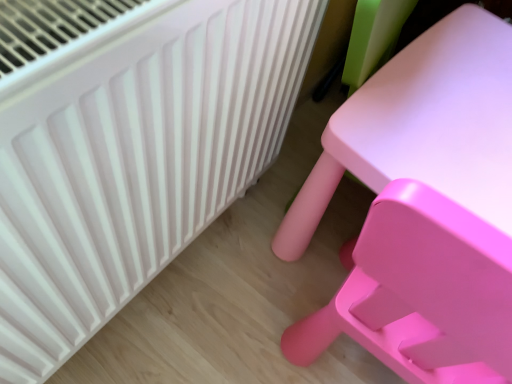
What are the coordinates of `white plastic radiator at upper left` in the screenshot? It's located at (128, 150).

What do you see at coordinates (128, 150) in the screenshot?
I see `white plastic radiator at upper left` at bounding box center [128, 150].

The height and width of the screenshot is (384, 512). What do you see at coordinates (423, 127) in the screenshot?
I see `matte plastic table at right` at bounding box center [423, 127].

At what (x,y) coordinates should I click in order to perform the action: click on matte plastic table at right. Please return your answer as a coordinate pair (x, y). The width and height of the screenshot is (512, 384). Looking at the image, I should click on (423, 127).

This screenshot has width=512, height=384. Find the location of `white plastic radiator at upper left`. white plastic radiator at upper left is located at coordinates pyautogui.click(x=128, y=150).

Is white plastic radiator at upper left at the left side of matte plastic table at right?

Yes, white plastic radiator at upper left is to the left of matte plastic table at right.

Which object is more forward, white plastic radiator at upper left or matte plastic table at right?

Positioned in front is matte plastic table at right.

Is point (61, 17) less distant than point (273, 240)?

Yes, it is.

From the image's perspective, which is below, white plastic radiator at upper left or matte plastic table at right?

white plastic radiator at upper left is shown below in the image.

From a real-world perspective, is white plastic radiator at upper left above or below matte plastic table at right?

white plastic radiator at upper left is below matte plastic table at right.

Considering the sizes of objects white plastic radiator at upper left and matte plastic table at right in the image provided, who is thinner, white plastic radiator at upper left or matte plastic table at right?

matte plastic table at right.

Who is taller, white plastic radiator at upper left or matte plastic table at right?

With more height is matte plastic table at right.

Considering the sizes of objects white plastic radiator at upper left and matte plastic table at right in the image provided, who is bigger, white plastic radiator at upper left or matte plastic table at right?

Bigger between the two is matte plastic table at right.

Is white plastic radiator at upper left spatially inside matte plastic table at right, or outside of it?

white plastic radiator at upper left lies outside matte plastic table at right.

Would you consider white plastic radiator at upper left to be distant from matte plastic table at right?

No, there isn't a large distance between white plastic radiator at upper left and matte plastic table at right.

Is white plastic radiator at upper left looking in the opposite direction of matte plastic table at right?

No, matte plastic table at right is not at the back of white plastic radiator at upper left.

In the image, there is a white plastic radiator at upper left. Identify the location of table above it (from the image's perspective). The width and height of the screenshot is (512, 384). (423, 127).

Is matte plastic table at right at the right side of white plastic radiator at upper left?

Yes, matte plastic table at right is to the right of white plastic radiator at upper left.

Between matte plastic table at right and white plastic radiator at upper left, which one is positioned in front?

matte plastic table at right is in front.

Between point (384, 68) and point (125, 188), which one is positioned behind?

The point (384, 68) is farther.

From the image's perspective, which object appears higher, matte plastic table at right or white plastic radiator at upper left?

matte plastic table at right.

From a real-world perspective, is matte plastic table at right located beneath white plastic radiator at upper left?

Actually, matte plastic table at right is physically above white plastic radiator at upper left in the real world.

Does matte plastic table at right have a greater width compared to white plastic radiator at upper left?

Incorrect, the width of matte plastic table at right does not surpass that of white plastic radiator at upper left.

Considering the relative sizes of matte plastic table at right and white plastic radiator at upper left in the image provided, is matte plastic table at right shorter than white plastic radiator at upper left?

Incorrect, the height of matte plastic table at right does not fall short of that of white plastic radiator at upper left.

Based on their sizes in the image, would you say matte plastic table at right is bigger or smaller than white plastic radiator at upper left?

matte plastic table at right is bigger than white plastic radiator at upper left.

Would you say white plastic radiator at upper left is part of matte plastic table at right's contents?

No, white plastic radiator at upper left is not a part of matte plastic table at right.

Is matte plastic table at right positioned far away from white plastic radiator at upper left?

No, matte plastic table at right is not far from white plastic radiator at upper left.

Is matte plastic table at right facing away from white plastic radiator at upper left?

That's not correct — matte plastic table at right is not looking away from white plastic radiator at upper left.

What are the coordinates of `table above the white plastic radiator at upper left (from the image's perspective)` in the screenshot? It's located at (423, 127).

Locate an element on the screen. The width and height of the screenshot is (512, 384). table above the white plastic radiator at upper left (from a real-world perspective) is located at coordinates (423, 127).

The width and height of the screenshot is (512, 384). In order to click on table that appears on the right of white plastic radiator at upper left in this screenshot , I will do `click(423, 127)`.